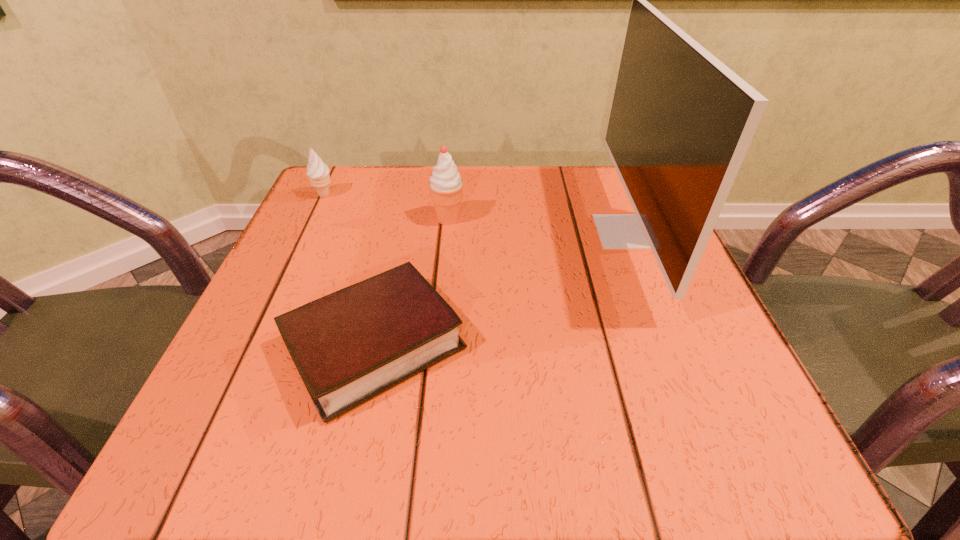
Where is `free space that is in between the monitor and the farther icecream`? The height and width of the screenshot is (540, 960). free space that is in between the monitor and the farther icecream is located at coordinates (475, 213).

What are the coordinates of `vacant space that's between the taller icecream and the tallest object` in the screenshot? It's located at (538, 225).

Where is `vacant space that is in between the shorter icecream and the Bible`? The image size is (960, 540). vacant space that is in between the shorter icecream and the Bible is located at coordinates (349, 270).

Where is `free space between the Bible and the second shortest object`? The height and width of the screenshot is (540, 960). free space between the Bible and the second shortest object is located at coordinates (349, 270).

Image resolution: width=960 pixels, height=540 pixels. Identify the location of vacant space that is in between the third tallest object and the tallest object. tap(475, 213).

You are a GUI agent. You are given a task and a screenshot of the screen. Output one action in this format:
    pyautogui.click(x=<x>, y=<y>)
    Task: Click on the empty space that is in between the shortest object and the rightmost object
    The width and height of the screenshot is (960, 540).
    Given the screenshot: What is the action you would take?
    pyautogui.click(x=501, y=288)

Locate which object is the closest to the tallest object. Please provide its 2D coordinates. Your answer should be formatted as a tuple, i.e. [(x, y)], where the tuple contains the x and y coordinates of a point satisfying the conditions above.

[(349, 346)]

You are a GUI agent. You are given a task and a screenshot of the screen. Output one action in this format:
    pyautogui.click(x=<x>, y=<y>)
    Task: Click on the third closest object to the farther icecream
    This screenshot has width=960, height=540.
    Given the screenshot: What is the action you would take?
    pyautogui.click(x=681, y=122)

Locate an element on the screen. This screenshot has width=960, height=540. vacant space that satisfies the following two spatial constraints: 1. on the front-facing side of the third shortest object; 2. on the right side of the left icecream is located at coordinates coord(314,219).

At what (x,y) coordinates should I click in order to perform the action: click on free location that satisfies the following two spatial constraints: 1. on the front-facing side of the Bible; 2. on the right side of the second shortest object. Please return your answer as a coordinate pair (x, y). This screenshot has width=960, height=540. Looking at the image, I should click on (254, 345).